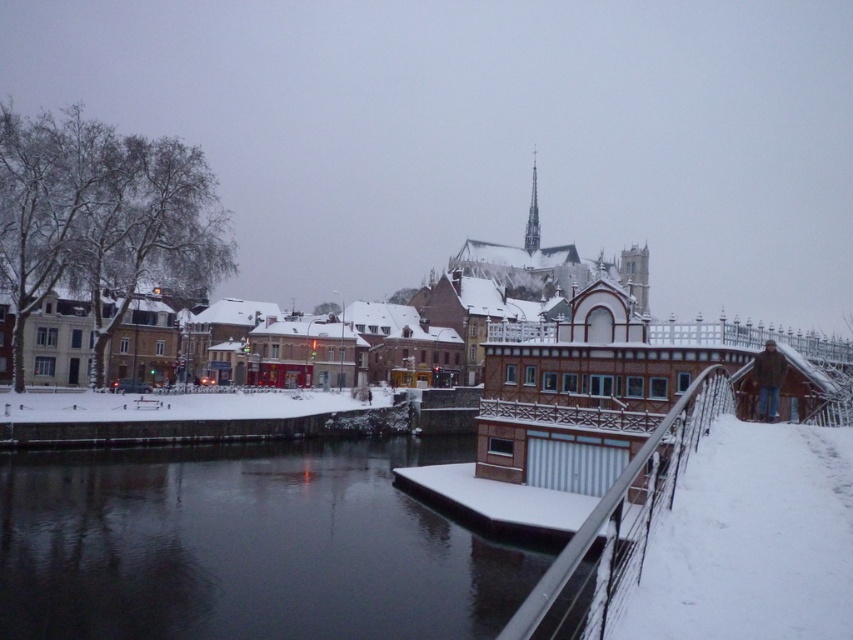
Question: Which object appears farthest from the camera in this image?

Choices:
 (A) metallic silver rail at right
 (B) smooth stone spire at upper center

Answer: (B)

Question: Observing the image, what is the correct spatial positioning of black water at center in reference to smooth stone spire at upper center?

Choices:
 (A) below
 (B) above

Answer: (A)

Question: Which of the following is the farthest from the observer?

Choices:
 (A) (537, 212)
 (B) (726, 396)

Answer: (A)

Question: Is black water at center positioned in front of smooth stone spire at upper center?

Choices:
 (A) yes
 (B) no

Answer: (A)

Question: In this image, where is metallic silver rail at right located relative to smooth stone spire at upper center?

Choices:
 (A) below
 (B) above

Answer: (A)

Question: Which object is the closest to the metallic silver rail at right?

Choices:
 (A) smooth stone spire at upper center
 (B) black water at center

Answer: (B)